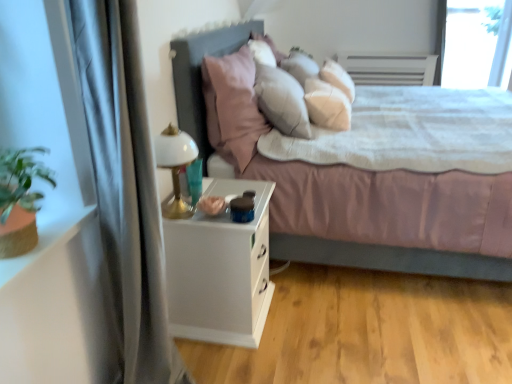
Question: From a real-world perspective, is pink fabric pillow at center positioned under transparent glass window screen at upper right based on gravity?

Choices:
 (A) yes
 (B) no

Answer: (A)

Question: Is pink fabric pillow at center located outside transparent glass window screen at upper right?

Choices:
 (A) no
 (B) yes

Answer: (B)

Question: Does pink fabric pillow at center have a lesser height compared to transparent glass window screen at upper right?

Choices:
 (A) yes
 (B) no

Answer: (A)

Question: Is pink fabric pillow at center positioned behind transparent glass window screen at upper right?

Choices:
 (A) yes
 (B) no

Answer: (B)

Question: Would you say pink fabric pillow at center contains transparent glass window screen at upper right?

Choices:
 (A) no
 (B) yes

Answer: (A)

Question: Would you say pink fabric pillow at center is a long distance from transparent glass window screen at upper right?

Choices:
 (A) no
 (B) yes

Answer: (B)

Question: Is white glossy table lamp at left facing away from pink fabric pillow at center?

Choices:
 (A) yes
 (B) no

Answer: (B)

Question: Does white glossy table lamp at left have a smaller size compared to pink fabric pillow at center?

Choices:
 (A) no
 (B) yes

Answer: (B)

Question: Considering the relative positions of white glossy table lamp at left and pink fabric pillow at center in the image provided, is white glossy table lamp at left behind pink fabric pillow at center?

Choices:
 (A) yes
 (B) no

Answer: (B)

Question: Can you confirm if white glossy table lamp at left is positioned to the right of pink fabric pillow at center?

Choices:
 (A) yes
 (B) no

Answer: (B)

Question: Considering the relative positions of white glossy table lamp at left and pink fabric pillow at center in the image provided, is white glossy table lamp at left to the left of pink fabric pillow at center from the viewer's perspective?

Choices:
 (A) no
 (B) yes

Answer: (B)

Question: Can you confirm if white glossy table lamp at left is thinner than pink fabric pillow at center?

Choices:
 (A) yes
 (B) no

Answer: (A)

Question: Are transparent glass window screen at upper right and silky gray curtain at left located far from each other?

Choices:
 (A) no
 (B) yes

Answer: (B)